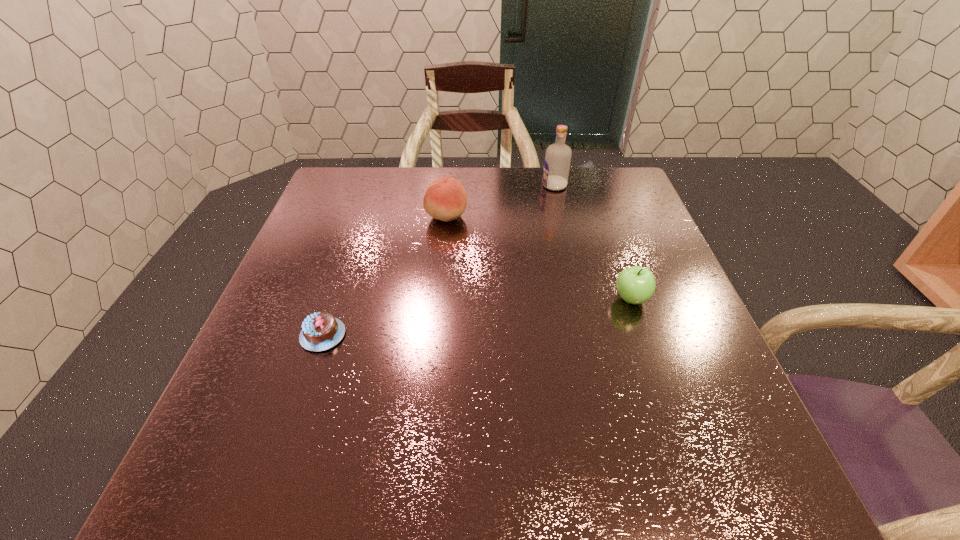
Identify the location of vacant space at the left edge. This screenshot has height=540, width=960. (324, 306).

In the image, there is a desktop. Where is `vacant space at the right edge`? The width and height of the screenshot is (960, 540). vacant space at the right edge is located at coordinates (605, 225).

In the image, there is a desktop. Where is `vacant region at the far left corner`? The height and width of the screenshot is (540, 960). vacant region at the far left corner is located at coordinates (344, 185).

Image resolution: width=960 pixels, height=540 pixels. In the image, there is a desktop. In order to click on vacant space at the far right corner in this screenshot , I will do click(625, 190).

Where is `vacant space at the near right corner of the desktop`? This screenshot has height=540, width=960. vacant space at the near right corner of the desktop is located at coordinates (733, 507).

Identify the location of empty space that is in between the vodka and the second farthest object. (500, 201).

The height and width of the screenshot is (540, 960). Identify the location of vacant region between the second farthest object and the apple. (539, 257).

Find the location of a particular element. This screenshot has width=960, height=540. vacant area between the third tallest object and the vodka is located at coordinates (592, 242).

In order to click on vacant point located between the farthest object and the apple in this screenshot , I will do `click(592, 242)`.

The width and height of the screenshot is (960, 540). In order to click on empty location between the peach and the leftmost object in this screenshot , I will do `click(385, 275)`.